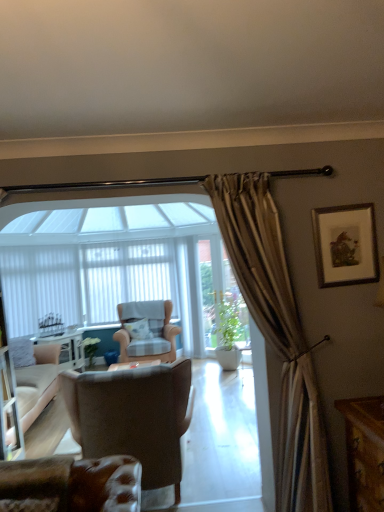
Identify the location of vacant point above leather at lower left, placed as the third chair when sorted from back to front (from a real-world perspective). (26, 464).